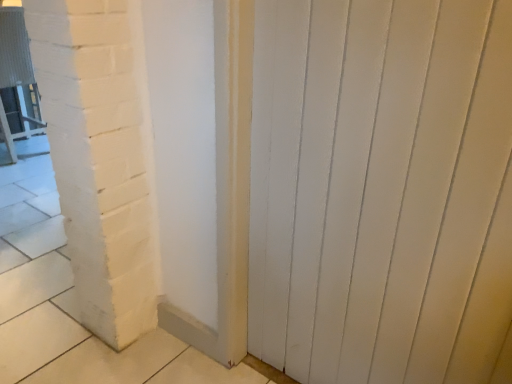
The width and height of the screenshot is (512, 384). What do you see at coordinates (17, 82) in the screenshot?
I see `metallic silver chair at left` at bounding box center [17, 82].

The height and width of the screenshot is (384, 512). In order to click on metallic silver chair at left in this screenshot , I will do `click(17, 82)`.

What do you see at coordinates (381, 189) in the screenshot? I see `white painted wood door at center` at bounding box center [381, 189].

The width and height of the screenshot is (512, 384). I want to click on white painted wood door at center, so click(381, 189).

Measure the distance between white painted wood door at center and camera.

white painted wood door at center is 70.32 centimeters away from camera.

Find the location of a particular element. This screenshot has width=512, height=384. metallic silver chair at left is located at coordinates (17, 82).

Is metallic silver chair at left to the right of white painted wood door at center from the viewer's perspective?

Incorrect, metallic silver chair at left is not on the right side of white painted wood door at center.

Which object is closer to the camera, metallic silver chair at left or white painted wood door at center?

white painted wood door at center is in front.

Which is further, (30,94) or (390,145)?

The point (30,94) is farther.

From the image's perspective, is metallic silver chair at left beneath white painted wood door at center?

Incorrect, from the image's perspective, metallic silver chair at left is higher than white painted wood door at center.

From a real-world perspective, is metallic silver chair at left physically above white painted wood door at center?

No, from a real-world perspective, metallic silver chair at left is not on top of white painted wood door at center.

Can you confirm if metallic silver chair at left is thinner than white painted wood door at center?

No.

Who is taller, metallic silver chair at left or white painted wood door at center?

With more height is white painted wood door at center.

Considering the sizes of objects metallic silver chair at left and white painted wood door at center in the image provided, who is smaller, metallic silver chair at left or white painted wood door at center?

white painted wood door at center is smaller.

Is metallic silver chair at left surrounding white painted wood door at center?

Definitely not — white painted wood door at center is not inside metallic silver chair at left.

Does metallic silver chair at left touch white painted wood door at center?

No, metallic silver chair at left is not with white painted wood door at center.

Is metallic silver chair at left aimed at white painted wood door at center?

No, metallic silver chair at left is not facing towards white painted wood door at center.

What's the angular difference between metallic silver chair at left and white painted wood door at center's facing directions?

There is a 90-degree angle between the facing directions of metallic silver chair at left and white painted wood door at center.

At what (x,y) coordinates should I click in order to perform the action: click on door that appears below the metallic silver chair at left (from the image's perspective). Please return your answer as a coordinate pair (x, y). This screenshot has width=512, height=384. Looking at the image, I should click on (381, 189).

Which object is positioned more to the right, white painted wood door at center or metallic silver chair at left?

From the viewer's perspective, white painted wood door at center appears more on the right side.

Does white painted wood door at center come in front of metallic silver chair at left?

Yes, white painted wood door at center is closer to the camera.

Between point (277, 174) and point (37, 114), which one is positioned behind?

The point (37, 114) is farther.

From the image's perspective, which is above, white painted wood door at center or metallic silver chair at left?

From the image's view, metallic silver chair at left is above.

From a real-world perspective, who is located lower, white painted wood door at center or metallic silver chair at left?

In real-world perspective, metallic silver chair at left is lower.

Can you confirm if white painted wood door at center is thinner than metallic silver chair at left?

Indeed, white painted wood door at center has a lesser width compared to metallic silver chair at left.

In terms of height, does white painted wood door at center look taller or shorter compared to metallic silver chair at left?

white painted wood door at center is taller than metallic silver chair at left.

Does white painted wood door at center have a smaller size compared to metallic silver chair at left?

Yes, white painted wood door at center is smaller than metallic silver chair at left.

Would you say white painted wood door at center is outside metallic silver chair at left?

Yes, white painted wood door at center is located beyond the bounds of metallic silver chair at left.

Is white painted wood door at center far away from metallic silver chair at left?

white painted wood door at center is positioned a significant distance from metallic silver chair at left.

Is metallic silver chair at left at the back of white painted wood door at center?

No, white painted wood door at center is not facing the opposite direction of metallic silver chair at left.

Find the location of a particular element. This screenshot has width=512, height=384. chair behind the white painted wood door at center is located at coordinates (17, 82).

Where is `door below the metallic silver chair at left (from the image's perspective)`? door below the metallic silver chair at left (from the image's perspective) is located at coordinates (381, 189).

This screenshot has width=512, height=384. Identify the location of chair on the left of white painted wood door at center. (17, 82).